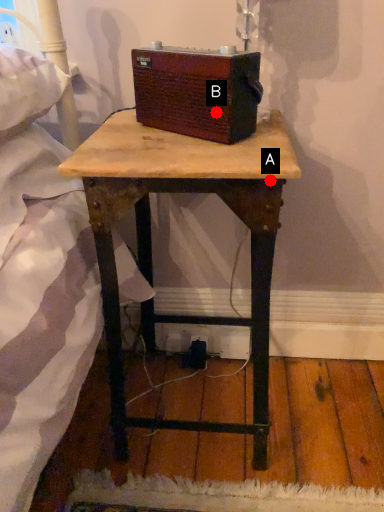
Question: Two points are circled on the image, labeled by A and B beside each circle. Which point is farther to the camera?

Choices:
 (A) A is further
 (B) B is further

Answer: (B)